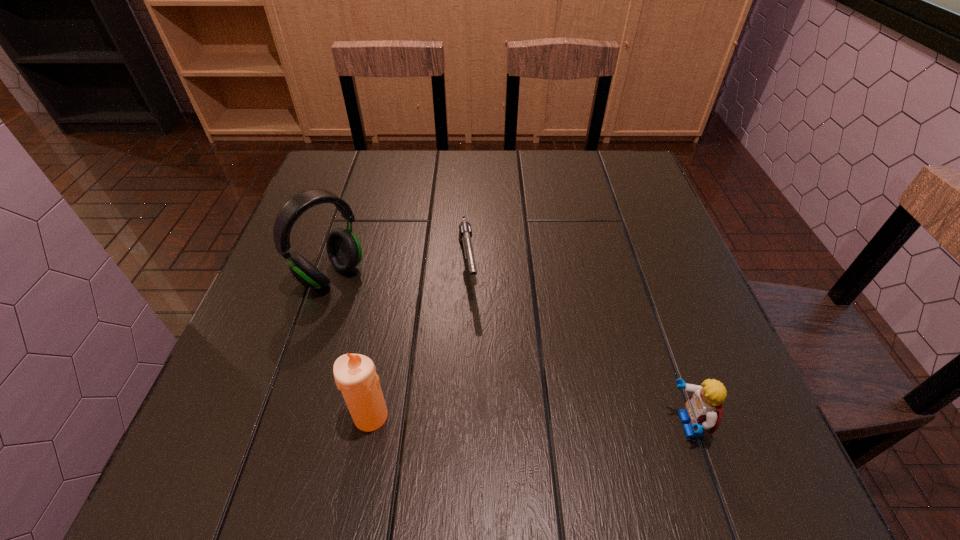
This screenshot has width=960, height=540. I want to click on free space that satisfies the following two spatial constraints: 1. on the back side of the second object from left to right; 2. on the left side of the second object from right to left, so click(x=398, y=265).